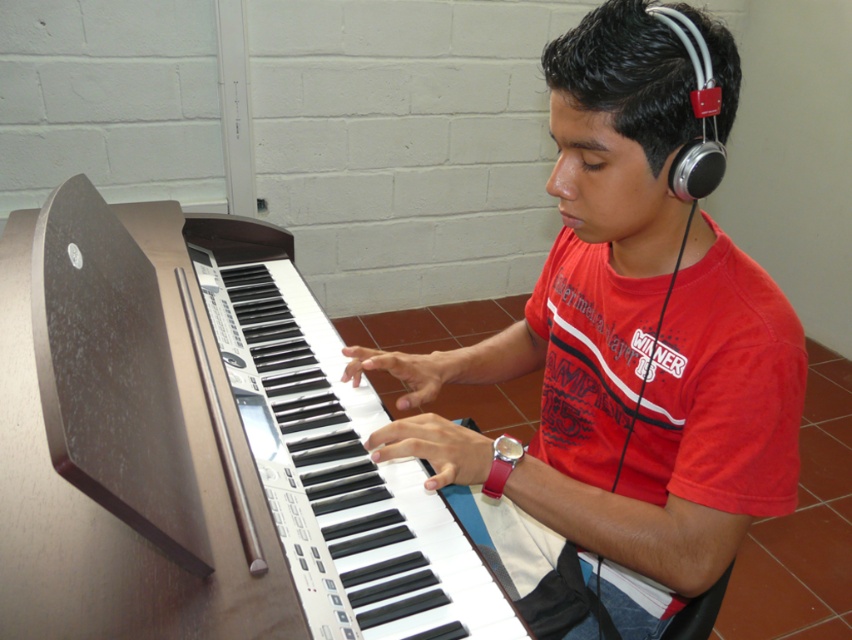
Consider the image. You are a music teacher who wants to move a 12 inch wide music stand between the brown polished piano at center and the matte black keyboard at center. Can the music stand fit between them?

The brown polished piano at center and the matte black keyboard at center are 12.24 inches apart, so yes, the music stand can fit between them since it is slightly narrower than the space available.